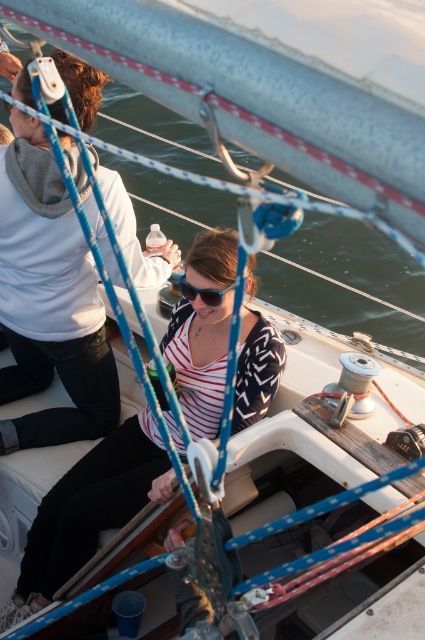
Can you confirm if white hoodie at upper left is thinner than striped fabric shirt at center?

Yes, white hoodie at upper left is thinner than striped fabric shirt at center.

Between point (31, 209) and point (147, 426), which one is positioned behind?

Positioned behind is point (147, 426).

Is point (45, 256) more distant than point (252, 289)?

Yes, it is behind point (252, 289).

At what (x,y) coordinates should I click in order to perform the action: click on white hoodie at upper left. Please return your answer as a coordinate pair (x, y). Looking at the image, I should click on [48, 300].

Between point (51, 352) and point (207, 289), which one is positioned behind?

Positioned behind is point (51, 352).

Is white hoodie at upper left thinner than sunglasses at center?

Incorrect, white hoodie at upper left's width is not less than sunglasses at center's.

Locate an element on the screen. Image resolution: width=425 pixels, height=640 pixels. white hoodie at upper left is located at coordinates (48, 300).

Who is lower down, striped fabric shirt at center or sunglasses at center?

striped fabric shirt at center is lower down.

Can you confirm if striped fabric shirt at center is positioned below sunglasses at center?

Yes, striped fabric shirt at center is below sunglasses at center.

This screenshot has width=425, height=640. In order to click on striped fabric shirt at center in this screenshot , I will do `click(88, 509)`.

Where is `striped fabric shirt at center`? striped fabric shirt at center is located at coordinates (88, 509).